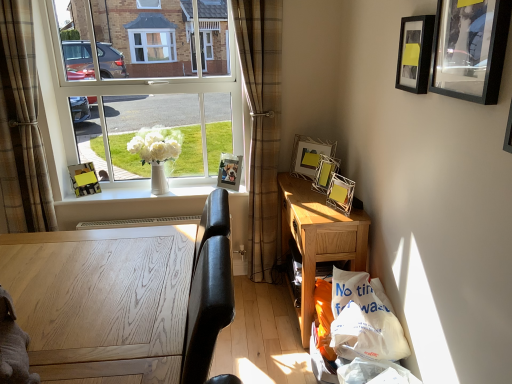
Identify the location of free space above white oak desk at lower left, the first desk viewed from the front (from a real-world perspective). (94, 283).